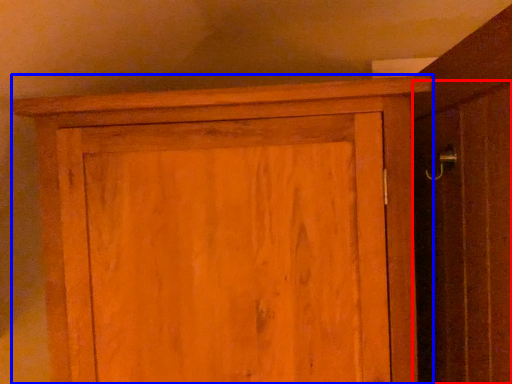
Question: Among these objects, which one is farthest to the camera, screen door (highlighted by a red box) or cupboard (highlighted by a blue box)?

Choices:
 (A) screen door
 (B) cupboard

Answer: (B)